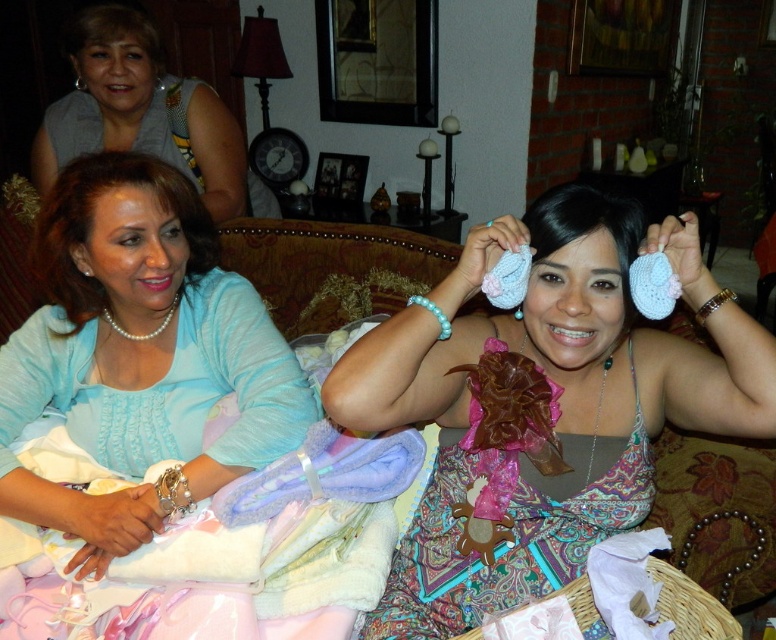
You are a photographer setting up for a family photo in the living room. You have to place a matte blue sweater at left and a pair of matte pink crochet booties at center. The distance between them must be exactly 18 inches. Based on the scene description, will the current placement meet the requirement?

The matte pink crochet booties at center is 18.15 inches away from the matte blue sweater at left. Since the required distance is 18 inches, the current placement is slightly over by 0.15 inches and may need adjustment for precision.